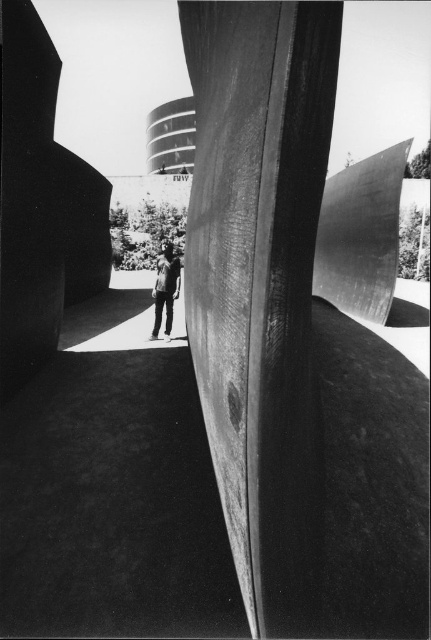
Is wooden sculpture at center smaller than dark gray jeans at center?

No.

In the scene shown: How much distance is there between wooden sculpture at center and dark gray jeans at center?

wooden sculpture at center and dark gray jeans at center are 12.09 feet apart from each other.

Is point (249, 154) in front of point (177, 296)?

Yes, it is in front of point (177, 296).

This screenshot has height=640, width=431. I want to click on wooden sculpture at center, so click(x=293, y=344).